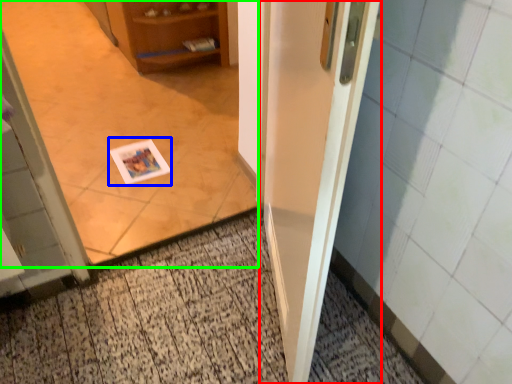
Question: Estimate the real-world distances between objects in this image. Which object is closer to door (highlighted by a red box), postcard (highlighted by a blue box) or corridor (highlighted by a green box)?

Choices:
 (A) postcard
 (B) corridor

Answer: (B)